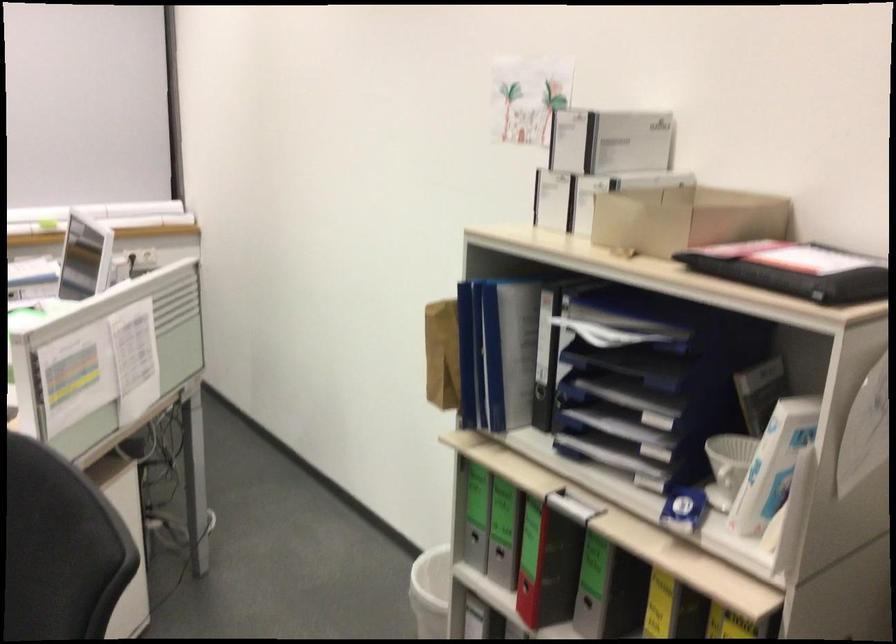
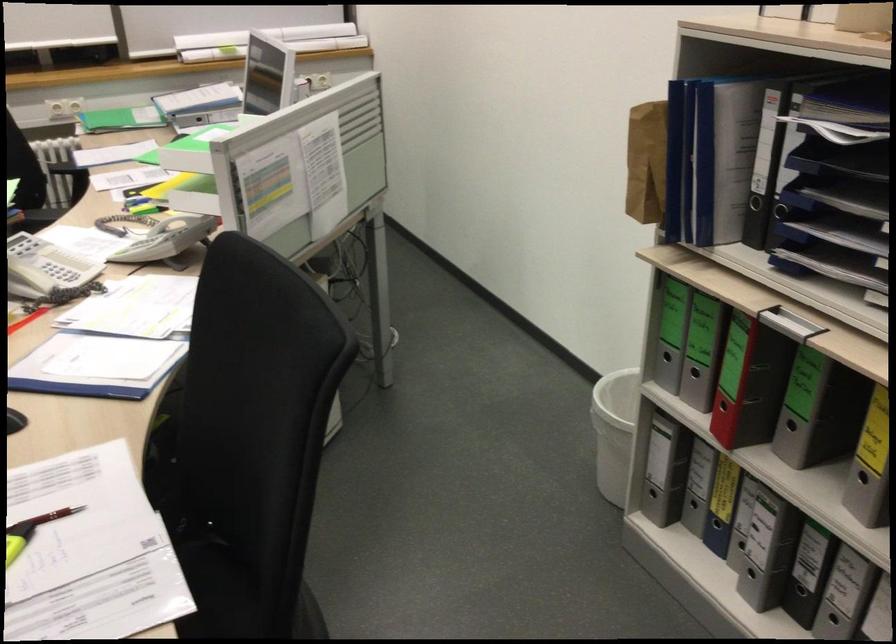
The point at (564, 398) is marked in the first image. Where is the corresponding point in the second image?

(779, 210)